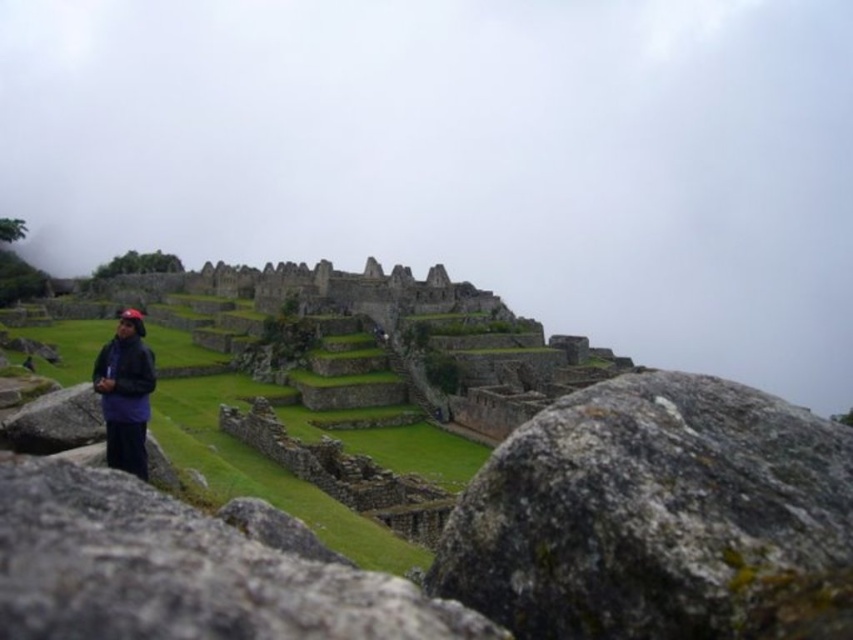
You are a hiker standing at the entrance of Machu Picchu. You see the white fog at upper center and the gray rough stone at center. Which object is closer to you?

The gray rough stone at center is closer to you because the white fog at upper center is further away.

In the scene shown: You are a hiker standing at the entrance of Machu Picchu and see the white fog at upper center and the gray rough stone at center. Which object is positioned to the left of the other?

The white fog at upper center is to the left of the gray rough stone at center.

You are a hiker planning to take a photo of Machu Picchu. You want to ensure that both the white fog at upper center and the gray rough stone at center are clearly visible in your shot. Based on their sizes, which object should you focus on to frame the photo properly?

The white fog at upper center might be wider than gray rough stone at center, so you should focus on the white fog at upper center to frame the photo properly since it occupies more space in the foreground.